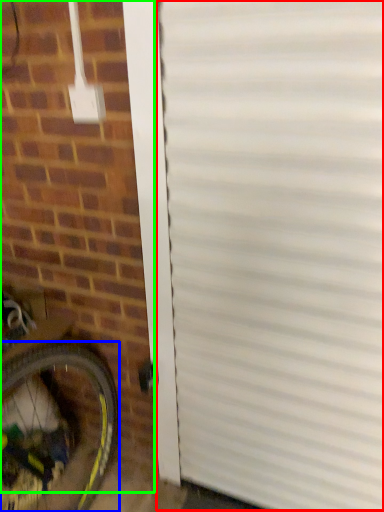
Question: Which object is positioned closest to garage door (highlighted by a red box)? Select from bicycle wheel (highlighted by a blue box) and brickwork (highlighted by a green box).

Choices:
 (A) bicycle wheel
 (B) brickwork

Answer: (B)